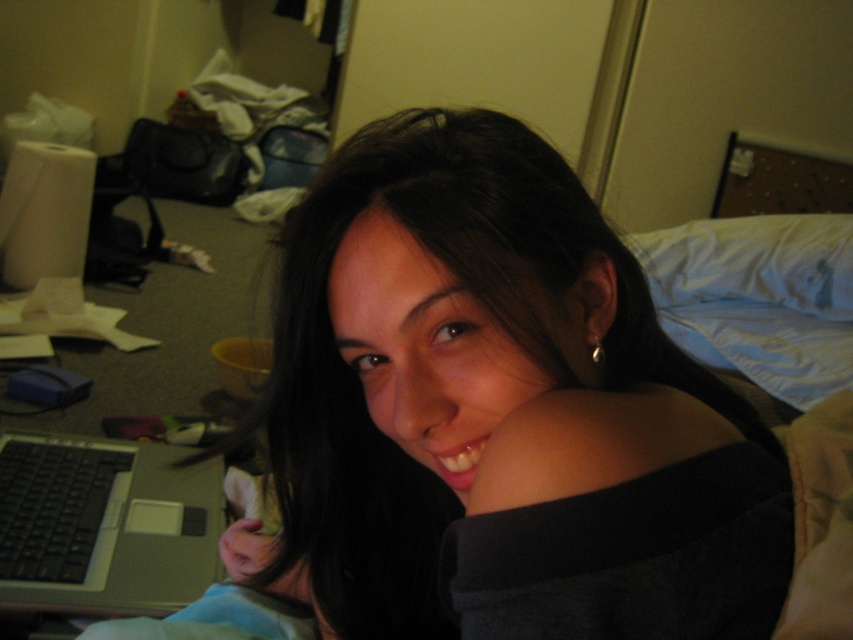
You are a photographer trying to capture a clear shot of the silver metallic laptop at lower left without the matte black hair at center blocking it. What adjustment should you make to your camera angle?

Since the matte black hair at center is in front of the silver metallic laptop at lower left, you should lower your camera angle to move the matte black hair at center out of the frame, allowing the silver metallic laptop at lower left to be visible.

You are a delivery robot entering a room and need to place a package on the silver metallic laptop at lower left. However, there is a white soft pillow at upper right in the way. Can you place the package on the laptop without moving the pillow?

The silver metallic laptop at lower left is in front of the white soft pillow at upper right, so the pillow is behind the laptop. Therefore, you can place the package on the silver metallic laptop at lower left without moving the pillow since it is already in front of the pillow.

You are a photographer trying to capture a closeup of the person in the scene. You need to ensure that both the matte black hair at center and the silver metallic laptop at lower left are visible in the frame. Based on their sizes, which object should you prioritize keeping within the camera frame?

The matte black hair at center is wider than the silver metallic laptop at lower left, so you should prioritize keeping the matte black hair at center in the frame since it takes up more space in the image.